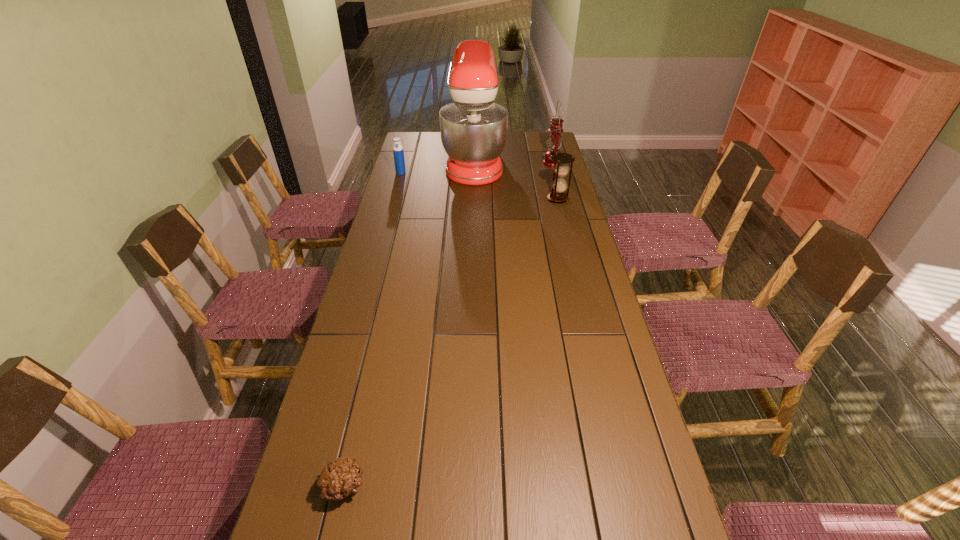
Where is `the tallest object`? the tallest object is located at coordinates pos(473,128).

The image size is (960, 540). In order to click on mixer in this screenshot , I will do `click(473, 128)`.

Image resolution: width=960 pixels, height=540 pixels. I want to click on oil lamp, so click(x=555, y=139).

The image size is (960, 540). What are the coordinates of `hourglass` in the screenshot? It's located at (559, 185).

I want to click on the fourth tallest object, so click(398, 152).

Where is `the shortest object`? the shortest object is located at coordinates (340, 478).

Identify the location of muffin. The height and width of the screenshot is (540, 960). (340, 478).

Locate an element on the screen. free space located 0.170m on the front-facing side of the tallest object is located at coordinates (538, 161).

The width and height of the screenshot is (960, 540). I want to click on free point located on the front of the second tallest object, so click(562, 198).

Locate an element on the screen. The image size is (960, 540). vacant space located 0.110m on the left of the hourglass is located at coordinates (522, 199).